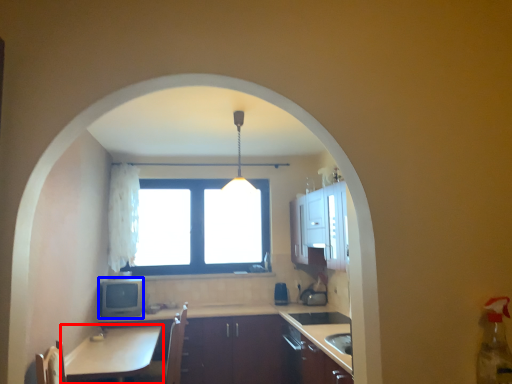
Question: Which object appears closest to the camera in this image, table (highlighted by a red box) or appliance (highlighted by a blue box)?

Choices:
 (A) table
 (B) appliance

Answer: (A)